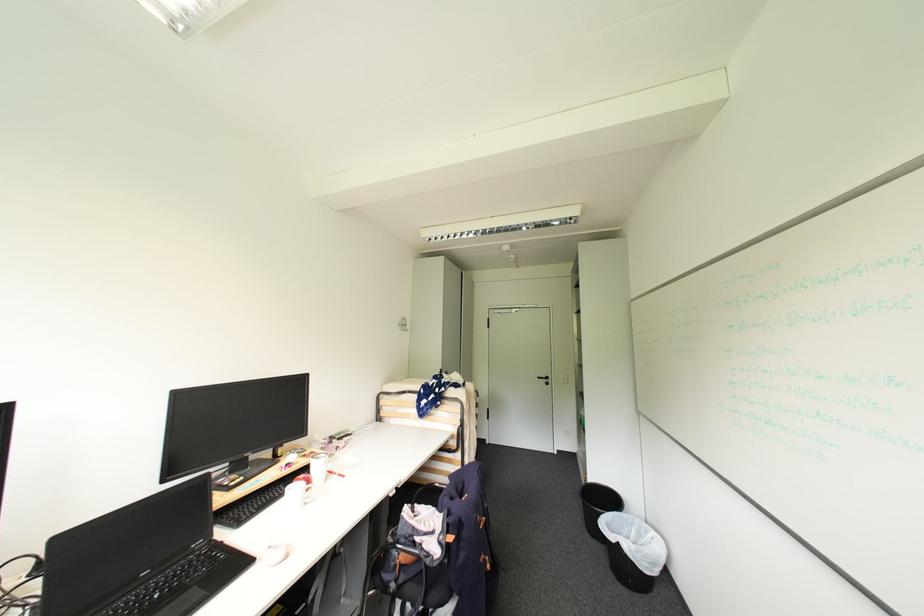
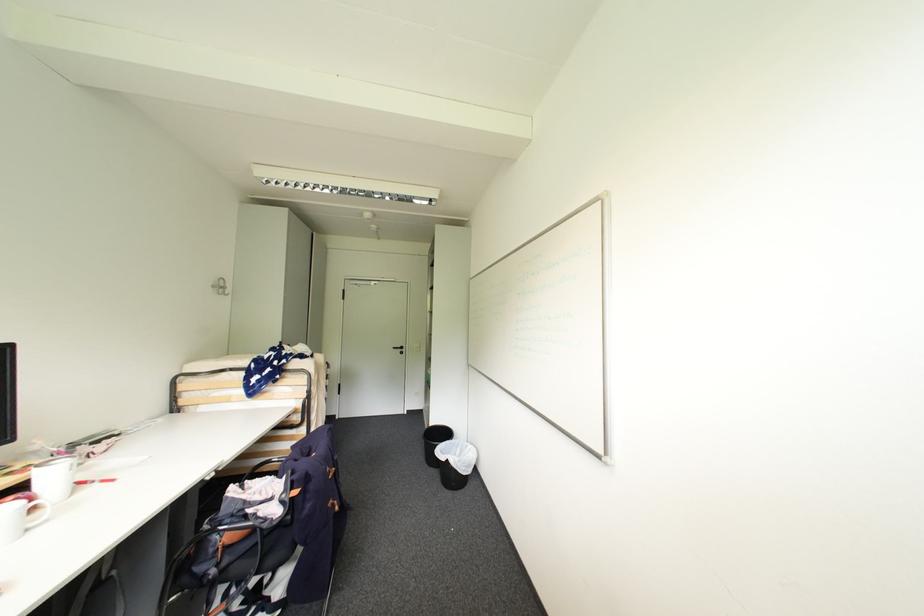
Where in the second image is the point corresponding to [406,325] from the first image?

(220, 286)